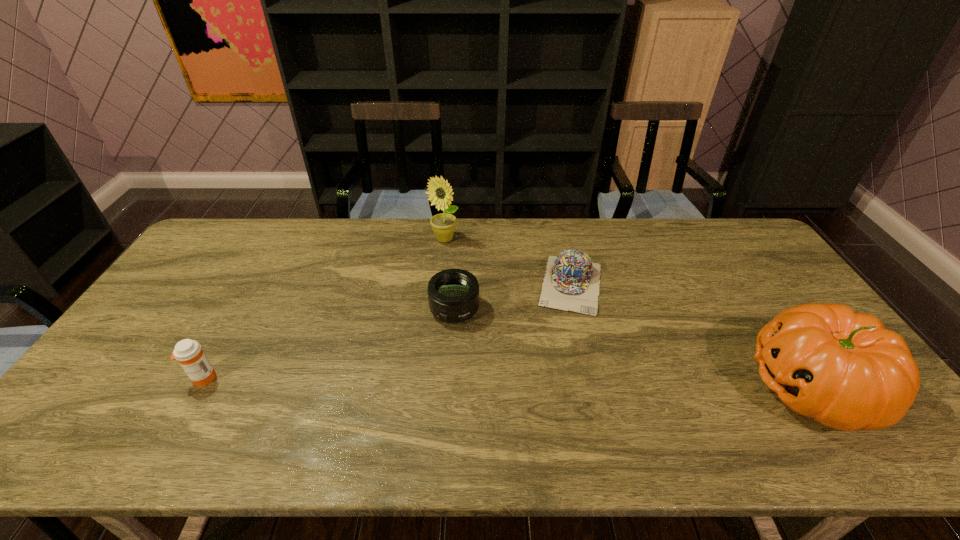
Identify the location of free space on the desktop that is between the leftmost object and the second tallest object and is positioned on the front, side, and top of the cap. The width and height of the screenshot is (960, 540). (557, 383).

You are a GUI agent. You are given a task and a screenshot of the screen. Output one action in this format:
    pyautogui.click(x=<x>, y=<y>)
    Task: Click on the vacant spot on the desktop that is between the third shortest object and the second tallest object and is positioned on the side of the fourth tallest object with brand markings and control switches
    Image resolution: width=960 pixels, height=540 pixels.
    Given the screenshot: What is the action you would take?
    pyautogui.click(x=433, y=381)

Identify the location of vacant spot on the desktop that is between the third shortest object and the second tallest object and is positioned on the face of the farthest object. (440, 381).